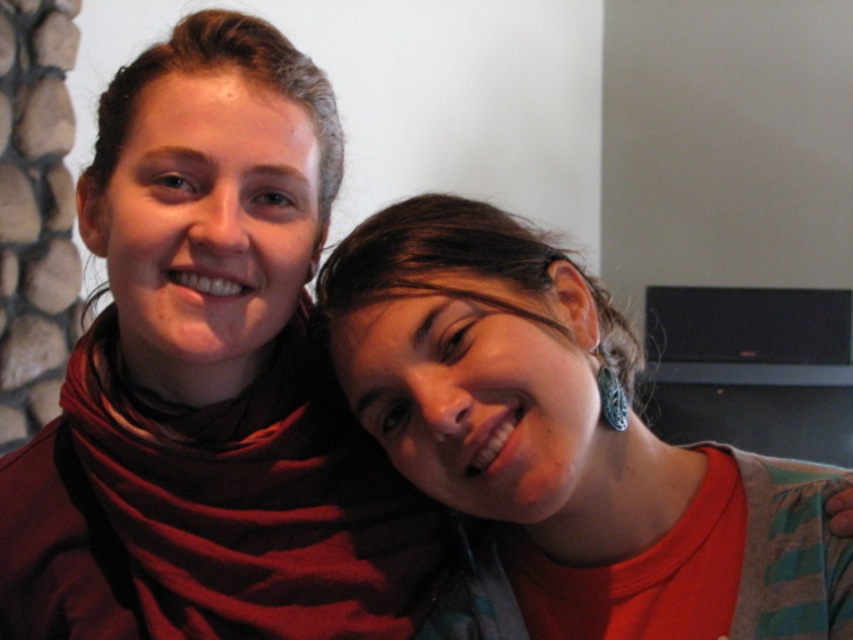
You are a photographer trying to focus on the teal earrings at upper right and the matte red scarf at upper left. Which object should you zoom in on to ensure both are in focus without changing the camera position?

The matte red scarf at upper left is larger in size than the teal earrings at upper right, so you should zoom in on the smaller object, the teal earrings at upper right, to ensure both are in focus without changing the camera position.

Consider the image. You are a photographer trying to focus on the teal earrings at upper right and the matte red scarf at upper left. Which object should you adjust your camera to focus on first if you want to start with the one closer to the front?

The teal earrings at upper right are positioned lower and thus closer to the front than the matte red scarf at upper left. Therefore, you should focus on the teal earrings at upper right first.